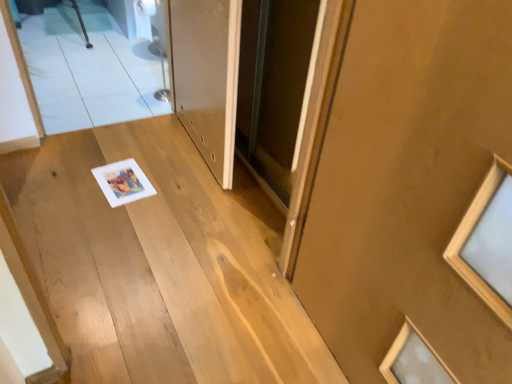
Question: Is point 189,41 positioned closer to the camera than point 73,258?

Choices:
 (A) closer
 (B) farther

Answer: (B)

Question: In terms of size, does white glossy door at center, marked as the 1th door in a left-to-right arrangement, appear bigger or smaller than wooden stairs at center?

Choices:
 (A) big
 (B) small

Answer: (B)

Question: Which object is the closest to the wooden stairs at center?

Choices:
 (A) white glossy door at center, the 2th door positioned from the right
 (B) clear glass mirror at upper left
 (C) matte brown door at center, which is the first door in right-to-left order

Answer: (A)

Question: Which object is positioned closest to the white glossy door at center, marked as the 1th door in a left-to-right arrangement?

Choices:
 (A) clear glass mirror at upper left
 (B) wooden stairs at center
 (C) matte brown door at center, the second door in the back-to-front sequence

Answer: (B)